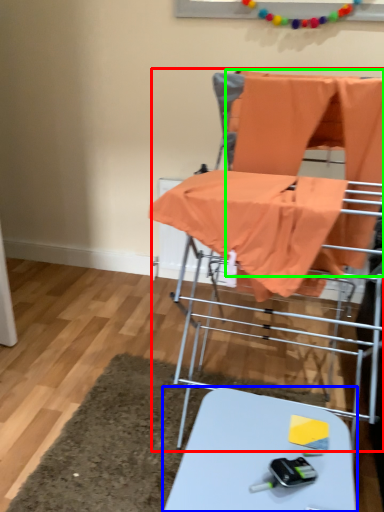
Question: Which is farther away from baby carriage (highlighted by a red box)? table (highlighted by a blue box) or fabric (highlighted by a green box)?

Choices:
 (A) table
 (B) fabric

Answer: (A)